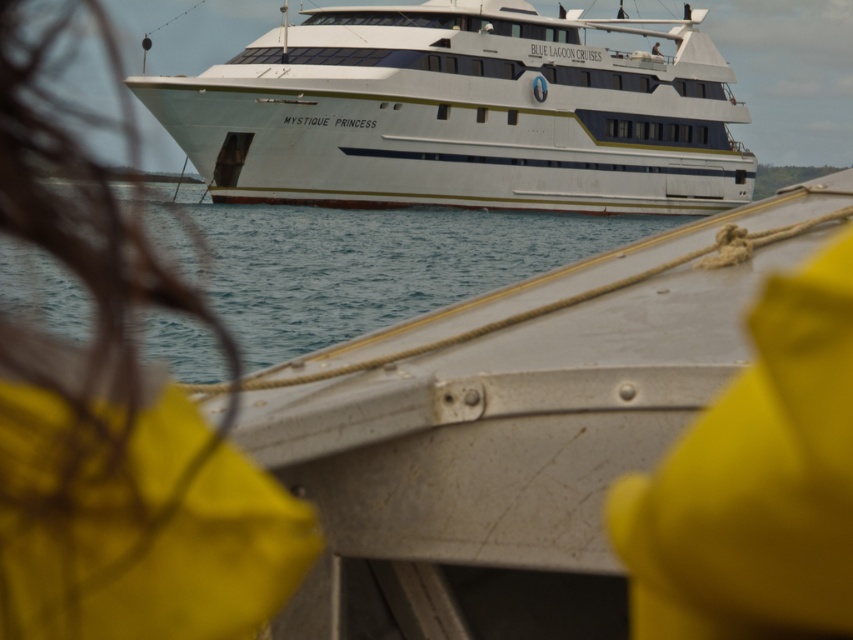
Question: Is yellow fabric at center thinner than white glossy ship at center?

Choices:
 (A) no
 (B) yes

Answer: (B)

Question: Does yellow fabric at center have a larger size compared to clear blue water at center?

Choices:
 (A) no
 (B) yes

Answer: (A)

Question: Which of these objects is positioned farthest from the white glossy ship at center?

Choices:
 (A) yellow fabric at center
 (B) clear blue water at center

Answer: (A)

Question: Which of the following is the farthest from the observer?

Choices:
 (A) clear blue water at center
 (B) white glossy ship at center
 (C) yellow fabric at center

Answer: (B)

Question: Which point is closer to the camera?

Choices:
 (A) (535, 106)
 (B) (154, 227)

Answer: (B)

Question: Does yellow fabric at center appear on the left side of clear blue water at center?

Choices:
 (A) yes
 (B) no

Answer: (B)